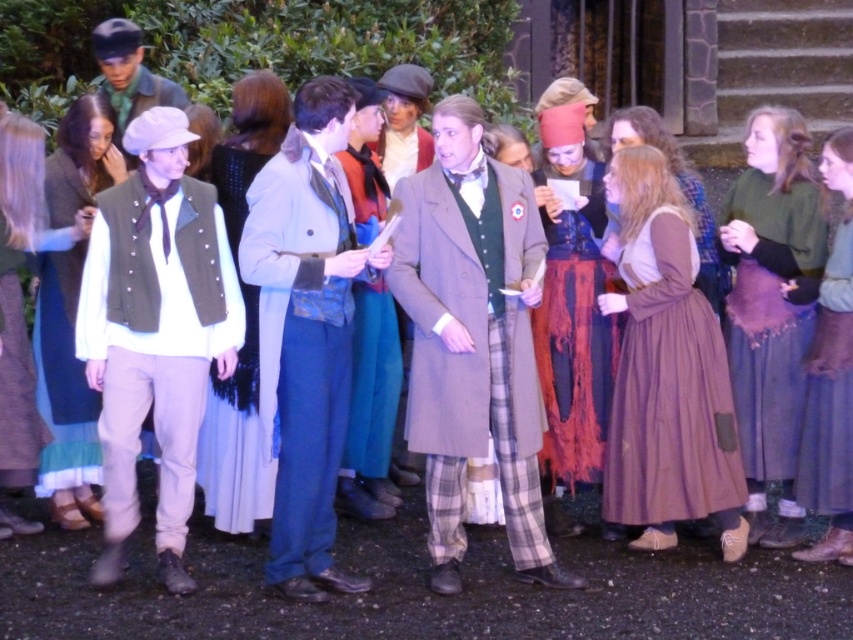
You are a photographer at the event and want to capture both the brown cotton dress at center and the blue woolen dress at center in a single shot. Which dress is positioned lower in the frame?

The brown cotton dress at center is below the blue woolen dress at center, so it is positioned lower in the frame.

In the scene shown: You are an artist sketching this scene and want to place the gray wool coat at center accurately. What are the coordinates where you should position it?

The gray wool coat at center should be positioned at coordinates (473, 340).